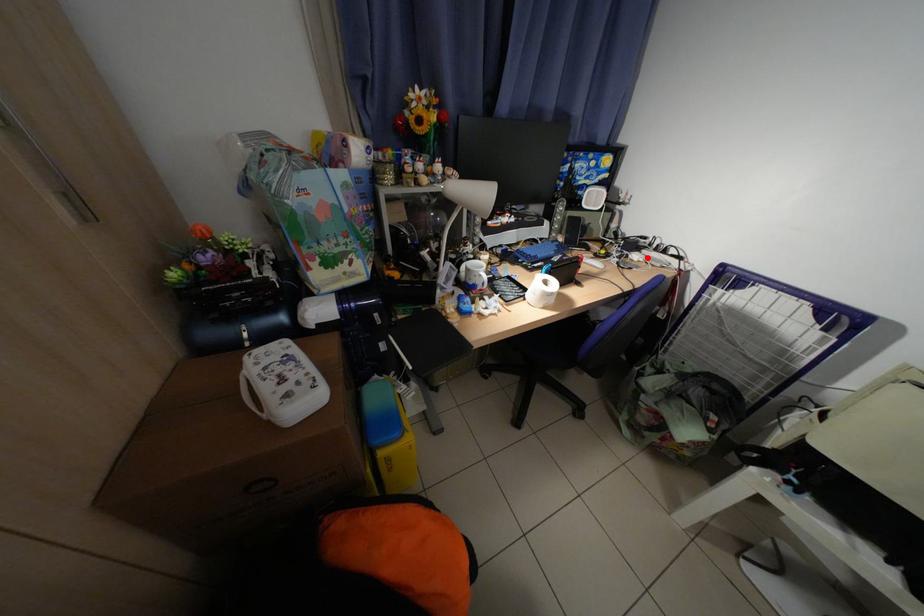
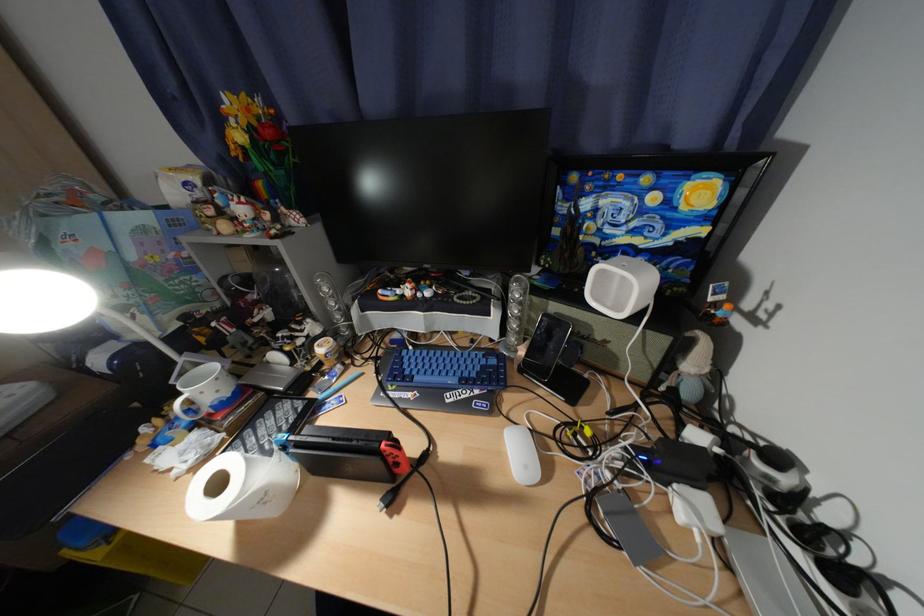
Find the pixel in the second image that matches the highlighted location in the first image.

(700, 508)